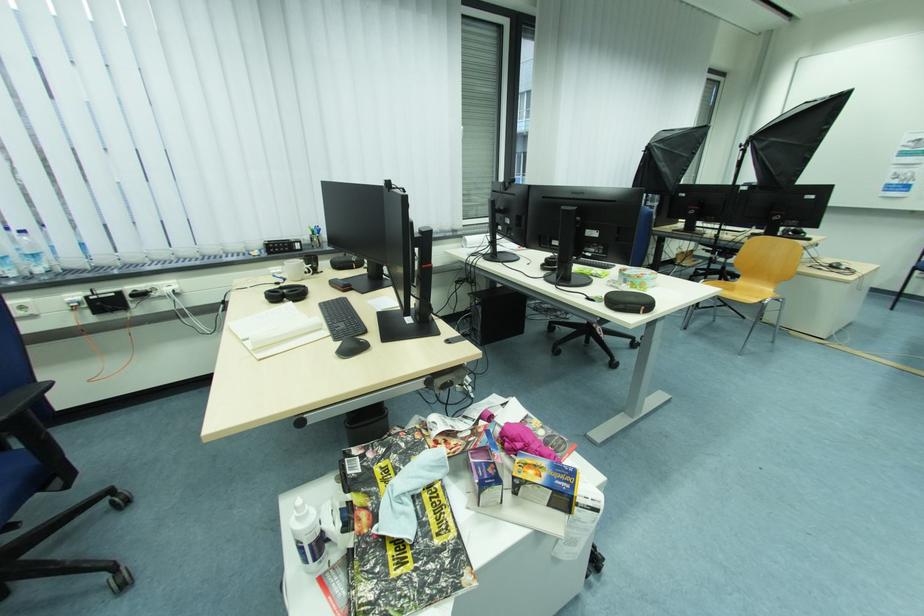
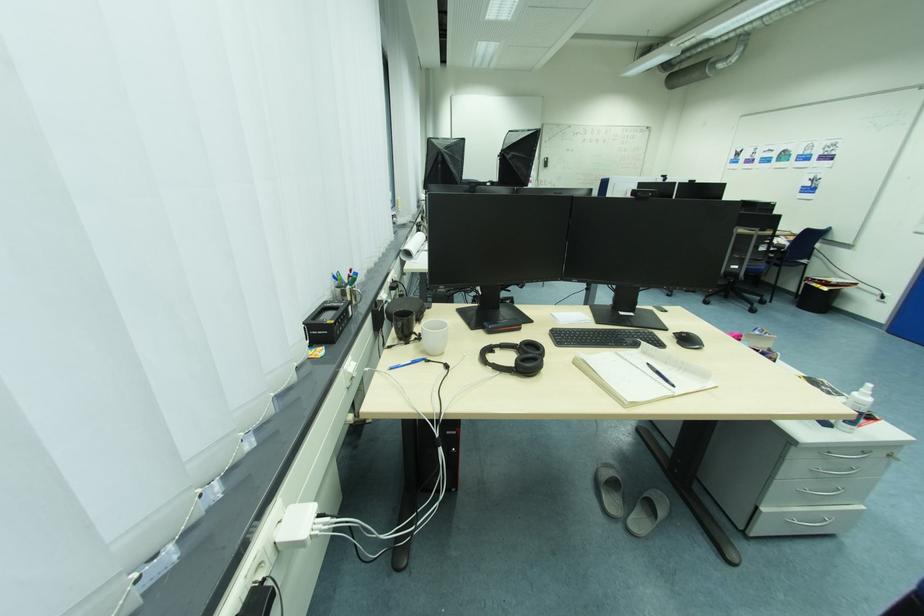
Question: I am providing you with two images of the same scene from different viewpoints. After the viewpoint changes to image2, which objects are now occluded?

Choices:
 (A) metal pen holder
 (B) blue pen
 (C) beige patterned mug
 (D) wooden chair sitting surface

Answer: (D)